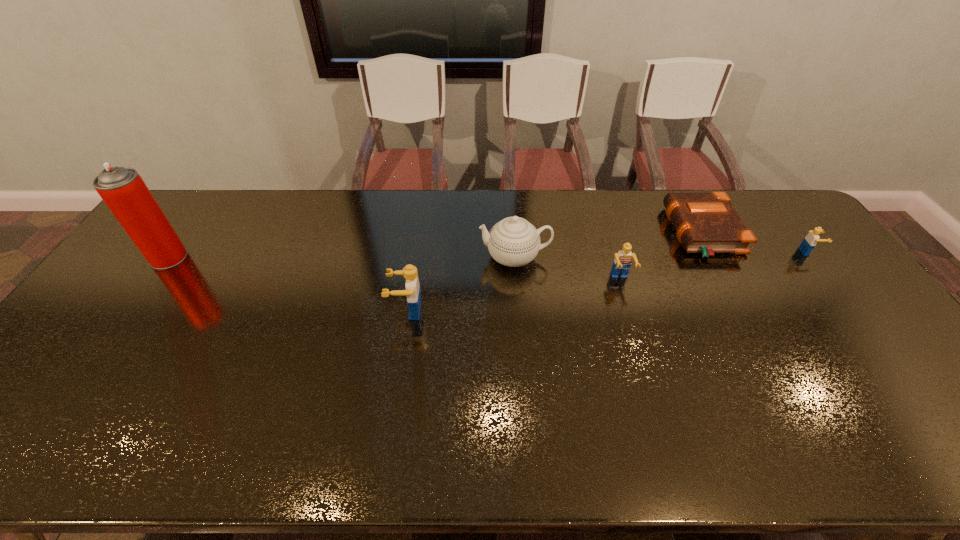
Please point out where to position a new Lego on the left to maintain spacing. Please provide its 2D coordinates. Your answer should be formatted as a tuple, i.e. [(x, y)], where the tuple contains the x and y coordinates of a point satisfying the conditions above.

[(161, 347)]